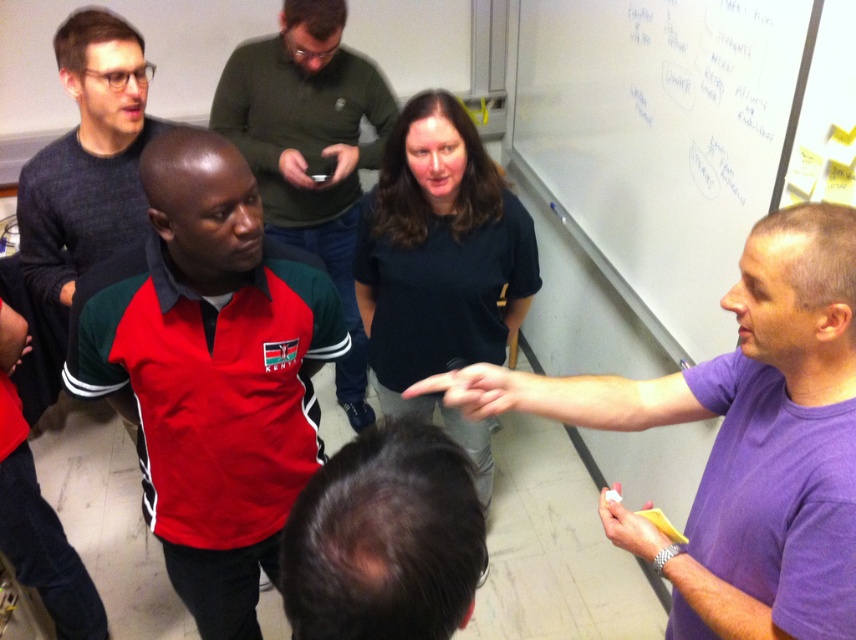
Question: Which point is farther to the camera?

Choices:
 (A) red polyester shirt at center
 (B) matte gray sweater at upper left

Answer: (B)

Question: Which is farther from the purple matte t-shirt at center?

Choices:
 (A) red and green jersey at center
 (B) whiteboard at upper right

Answer: (A)

Question: Which point appears farthest from the camera in this image?

Choices:
 (A) (55, 365)
 (B) (334, 371)
 (C) (753, 620)
 (D) (256, 228)

Answer: (B)

Question: Is whiteboard at upper right positioned at the back of black matte shirt at center?

Choices:
 (A) yes
 (B) no

Answer: (B)

Question: Does purple matte t-shirt at center appear over matte gray sweater at upper left?

Choices:
 (A) yes
 (B) no

Answer: (B)

Question: Can you confirm if red polyester shirt at center is thinner than whiteboard at upper right?

Choices:
 (A) no
 (B) yes

Answer: (A)